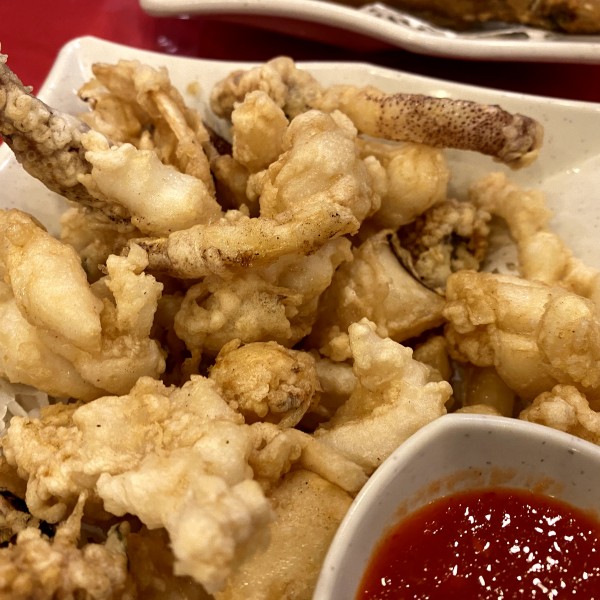
The image size is (600, 600). Find the location of `plate`. plate is located at coordinates (475, 50).